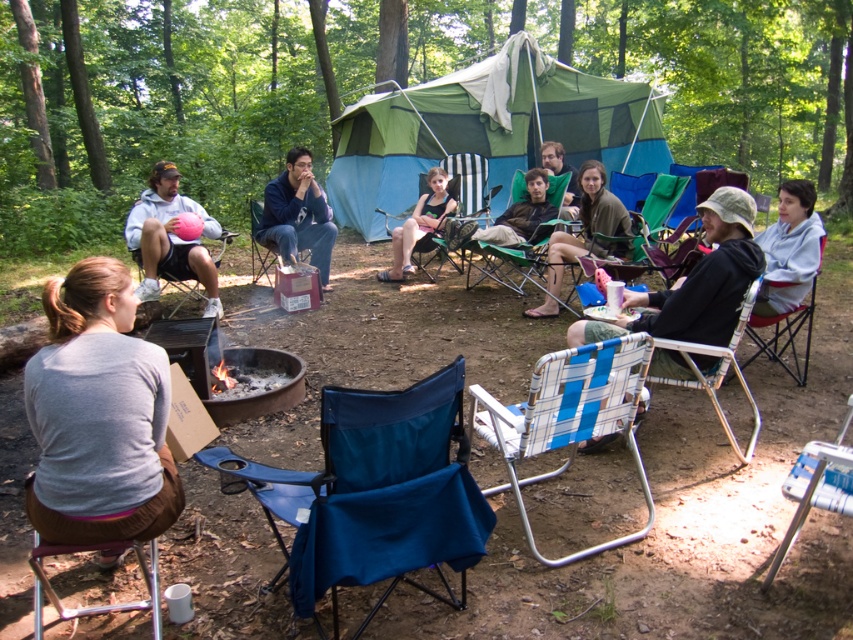
Question: Can you confirm if blue fabric folding chair at center is wider than blue and white striped folding chair at center?

Choices:
 (A) no
 (B) yes

Answer: (B)

Question: Which object appears farthest from the camera in this image?

Choices:
 (A) green fabric chair at center
 (B) blue and white striped folding chair at center
 (C) matte plastic chair at center
 (D) blue fabric chair at lower right

Answer: (C)

Question: Can you confirm if brown fabric chair at lower left is bigger than black mesh chair at center?

Choices:
 (A) no
 (B) yes

Answer: (A)

Question: Which object appears closest to the camera in this image?

Choices:
 (A) blue fabric folding chair at center
 (B) matte brown jacket at center

Answer: (A)

Question: Does green canvas tent at center appear on the left side of green fabric chair at center?

Choices:
 (A) yes
 (B) no

Answer: (B)

Question: Which point is closer to the camera?

Choices:
 (A) green canvas tent at center
 (B) blue fabric folding chair at center
 (C) matte black jacket at center
 (D) blue fleece jacket at center

Answer: (B)